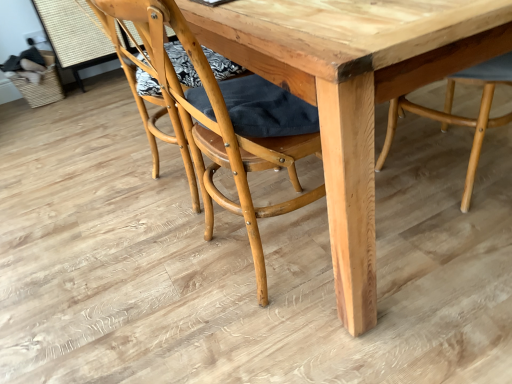
Find the location of a particular element. The image size is (512, 384). vacant space to the left of natural wood table at center is located at coordinates (95, 208).